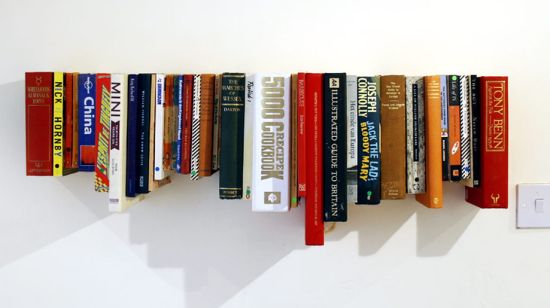
Image resolution: width=550 pixels, height=308 pixels. I want to click on red books, so click(x=42, y=151), click(x=67, y=151), click(x=103, y=123), click(x=167, y=137), click(x=185, y=137), click(x=300, y=145), click(x=315, y=148), click(x=489, y=139), click(x=92, y=144).